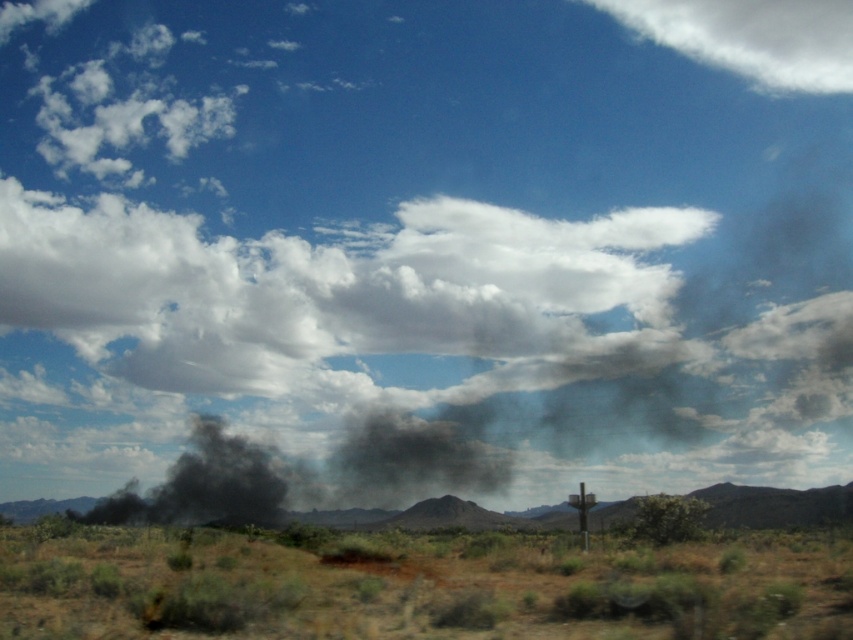
Question: Which point is closer to the camera?

Choices:
 (A) brown dry grass at lower left
 (B) white fluffy cloud at upper center
 (C) black smoke at center

Answer: (A)

Question: Observing the image, what is the correct spatial positioning of brown dry grass at lower left in reference to white fluffy cloud at upper center?

Choices:
 (A) right
 (B) left

Answer: (B)

Question: Which of the following is the farthest from the observer?

Choices:
 (A) white fluffy cloud at upper center
 (B) black matte smoke at center
 (C) black smoke at center

Answer: (A)

Question: Is the position of white fluffy cloud at upper center more distant than that of black smoke at center?

Choices:
 (A) no
 (B) yes

Answer: (B)

Question: Is brown dry grass at lower left bigger than black smoke at center?

Choices:
 (A) no
 (B) yes

Answer: (B)

Question: Which point is farther from the camera taking this photo?

Choices:
 (A) (795, 17)
 (B) (212, 481)

Answer: (A)